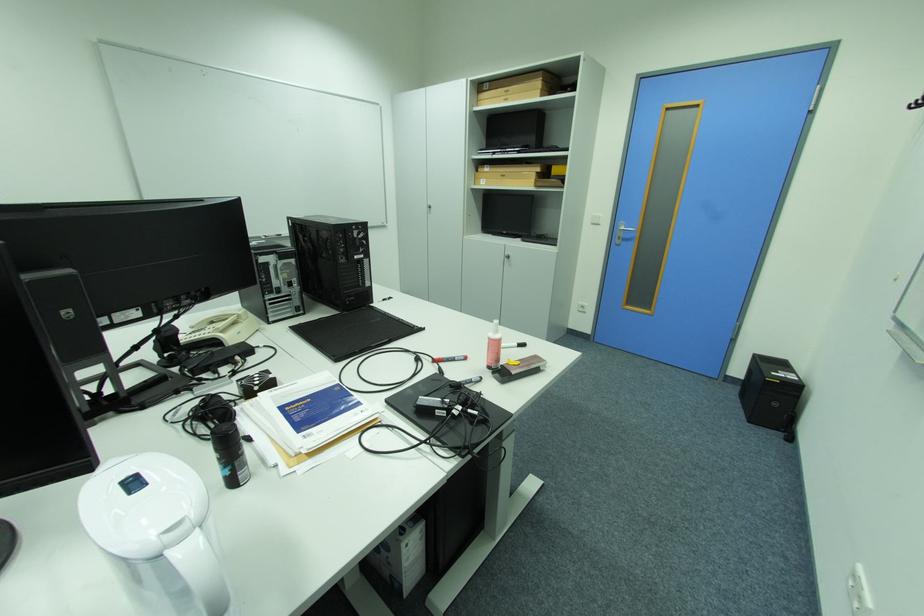
Which object does [448,359] point to?

It refers to a red marker.